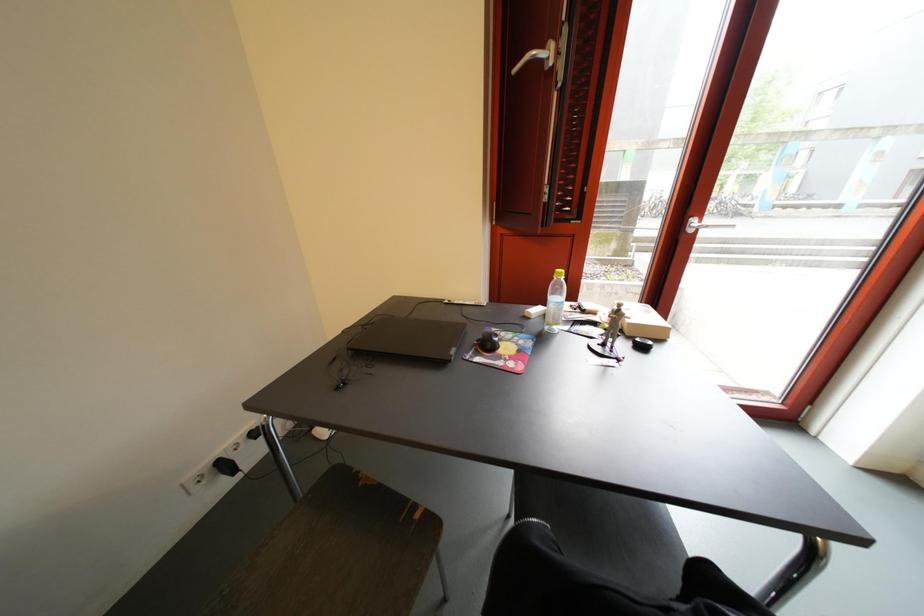
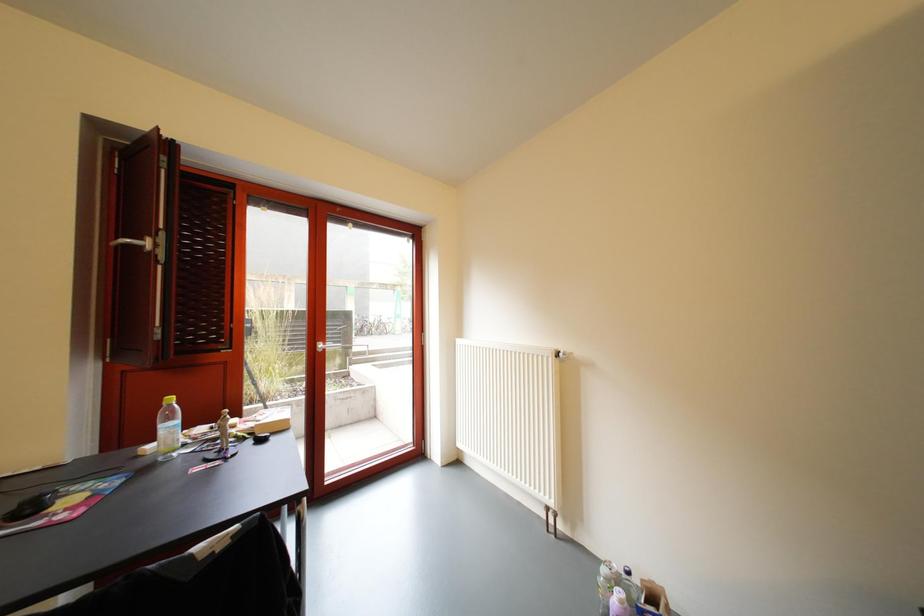
First-person continuous shooting, in which direction is the camera rotating?

The camera rotated toward right-up.